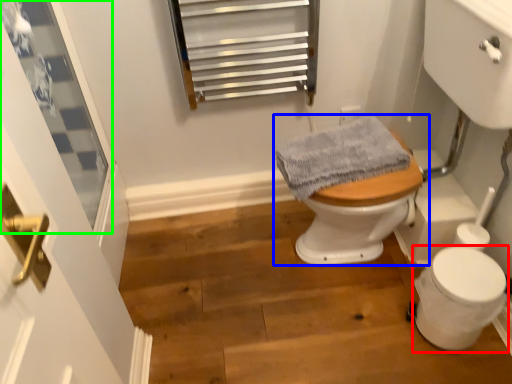
Question: Which object is positioned farthest from toilet bowl (highlighted by a red box)? Select from toilet (highlighted by a blue box) and window (highlighted by a green box).

Choices:
 (A) toilet
 (B) window

Answer: (B)